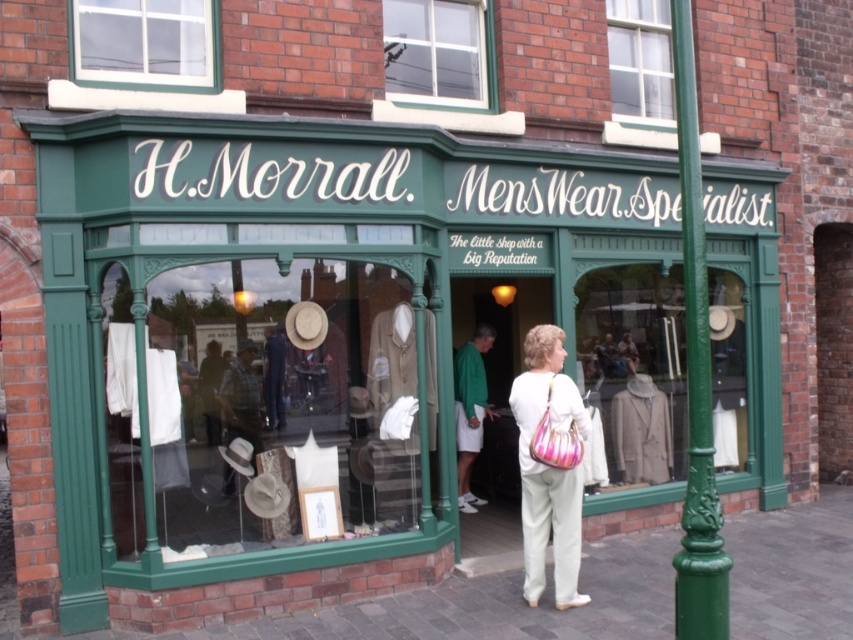
Question: Considering the real-world distances, which object is closest to the white fabric handbag at center?

Choices:
 (A) green painted metal pole at right
 (B) clear glass window at upper center
 (C) matte green storefront at center
 (D) green fabric shirt at center

Answer: (A)

Question: Is clear glass window at upper center smaller than green fabric shirt at center?

Choices:
 (A) yes
 (B) no

Answer: (A)

Question: Can you confirm if matte glass window at center is smaller than green painted metal pole at right?

Choices:
 (A) no
 (B) yes

Answer: (A)

Question: Among these points, which one is nearest to the camera?

Choices:
 (A) click(454, 17)
 (B) click(473, 499)
 (C) click(703, 262)
 (D) click(231, 440)

Answer: (C)

Question: Is matte glass window at center below green fabric shirt at center?

Choices:
 (A) yes
 (B) no

Answer: (B)

Question: Which object is the closest to the matte glass window at center?

Choices:
 (A) green painted metal pole at right
 (B) white fabric handbag at center
 (C) green fabric shirt at center
 (D) matte green storefront at center

Answer: (D)